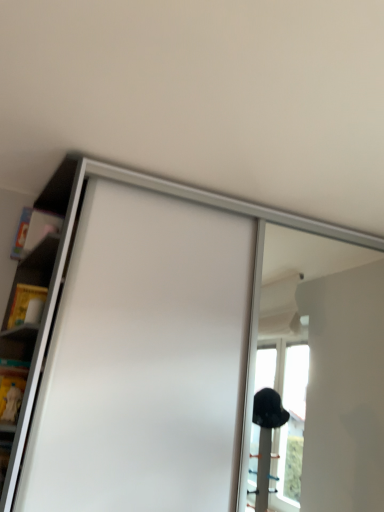
Question: Is white matte sliding door at center taller than white glossy shelf at upper left?

Choices:
 (A) no
 (B) yes

Answer: (B)

Question: Is white matte sliding door at center behind white glossy shelf at upper left?

Choices:
 (A) yes
 (B) no

Answer: (A)

Question: Is white matte sliding door at center closer to camera compared to white glossy shelf at upper left?

Choices:
 (A) yes
 (B) no

Answer: (B)

Question: From the image's perspective, is white matte sliding door at center located above white glossy shelf at upper left?

Choices:
 (A) no
 (B) yes

Answer: (A)

Question: Considering the relative positions of white matte sliding door at center and white glossy shelf at upper left in the image provided, is white matte sliding door at center to the left of white glossy shelf at upper left from the viewer's perspective?

Choices:
 (A) no
 (B) yes

Answer: (A)

Question: From a real-world perspective, does white matte sliding door at center sit lower than white glossy shelf at upper left?

Choices:
 (A) yes
 (B) no

Answer: (A)

Question: Can you confirm if white glossy shelf at upper left is bigger than white matte sliding door at center?

Choices:
 (A) yes
 (B) no

Answer: (B)

Question: Is white glossy shelf at upper left completely or partially outside of white matte sliding door at center?

Choices:
 (A) yes
 (B) no

Answer: (A)

Question: From a real-world perspective, is white glossy shelf at upper left under white matte sliding door at center?

Choices:
 (A) no
 (B) yes

Answer: (A)

Question: From the image's perspective, does white glossy shelf at upper left appear lower than white matte sliding door at center?

Choices:
 (A) yes
 (B) no

Answer: (B)

Question: Is white glossy shelf at upper left far from white matte sliding door at center?

Choices:
 (A) no
 (B) yes

Answer: (A)

Question: Is white glossy shelf at upper left next to white matte sliding door at center?

Choices:
 (A) yes
 (B) no

Answer: (B)

Question: Relative to white glossy shelf at upper left, is white matte sliding door at center in front or behind?

Choices:
 (A) front
 (B) behind

Answer: (B)